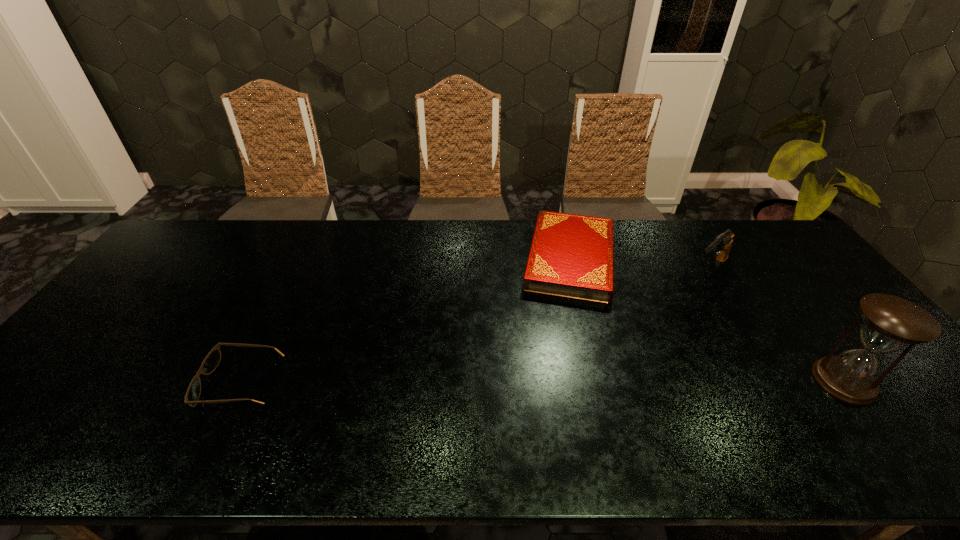
Identify the location of object located in the right edge section of the desktop. (890, 323).

Identify the location of object positioned at the near right corner. (890, 323).

The image size is (960, 540). I want to click on free space at the far edge of the desktop, so click(643, 253).

The image size is (960, 540). Find the location of `vacant space at the near edge of the desktop`. vacant space at the near edge of the desktop is located at coordinates (815, 410).

In the image, there is a desktop. Identify the location of vacant space at the left edge. (147, 280).

Locate an element on the screen. This screenshot has height=540, width=960. vacant area at the right edge of the desktop is located at coordinates (798, 303).

Find the location of `free space at the far left corner of the desktop`. free space at the far left corner of the desktop is located at coordinates (190, 246).

Locate an element on the screen. free space between the second object from left to right and the rightmost object is located at coordinates pyautogui.click(x=708, y=320).

Locate an element on the screen. The width and height of the screenshot is (960, 540). free spot between the sunglasses and the gun is located at coordinates (475, 326).

This screenshot has height=540, width=960. Find the location of `empty space between the leftmost object and the rightmost object`. empty space between the leftmost object and the rightmost object is located at coordinates (542, 382).